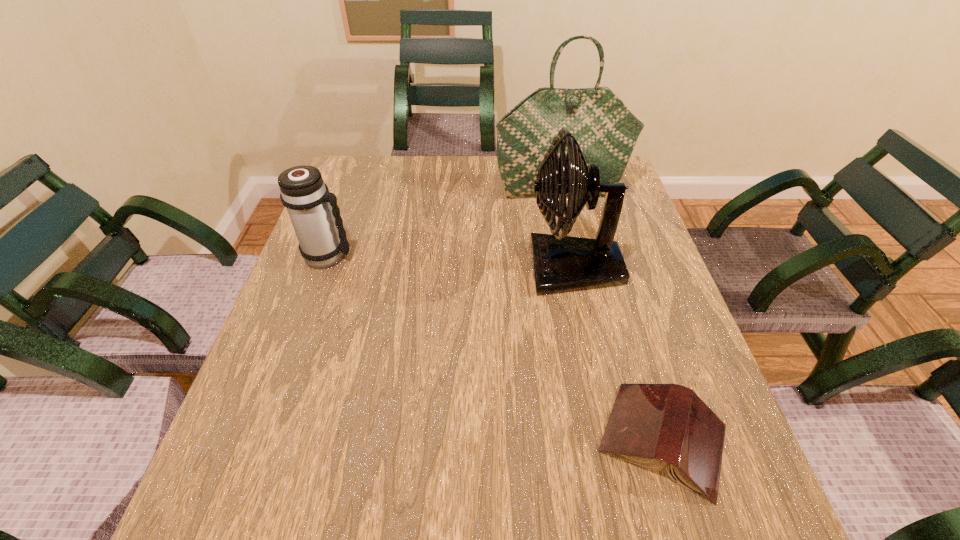
Locate an element on the screen. The image size is (960, 540). vacant space located 0.390m in front of the fan to blow air is located at coordinates (366, 268).

The height and width of the screenshot is (540, 960). In order to click on free space located on the side with the handle of the leftmost object in this screenshot , I will do `click(500, 256)`.

At what (x,y) coordinates should I click in order to perform the action: click on free space located on the back of the shortest object. Please return your answer as a coordinate pair (x, y). Image resolution: width=960 pixels, height=540 pixels. Looking at the image, I should click on (614, 281).

I want to click on object situated at the far edge, so click(606, 130).

Locate an element on the screen. The width and height of the screenshot is (960, 540). object that is at the near edge is located at coordinates (651, 425).

You are a GUI agent. You are given a task and a screenshot of the screen. Output one action in this format:
    pyautogui.click(x=<x>, y=<y>)
    Task: Click on the object that is positioned at the left edge
    The height and width of the screenshot is (540, 960).
    Given the screenshot: What is the action you would take?
    pyautogui.click(x=322, y=239)

Where is `tote bag located at the right edge`? This screenshot has width=960, height=540. tote bag located at the right edge is located at coordinates (606, 130).

This screenshot has width=960, height=540. I want to click on fan positioned at the right edge, so click(561, 263).

Where is `book that is at the right edge`? book that is at the right edge is located at coordinates (651, 425).

What are the coordinates of `object present at the far right corner` in the screenshot? It's located at (606, 130).